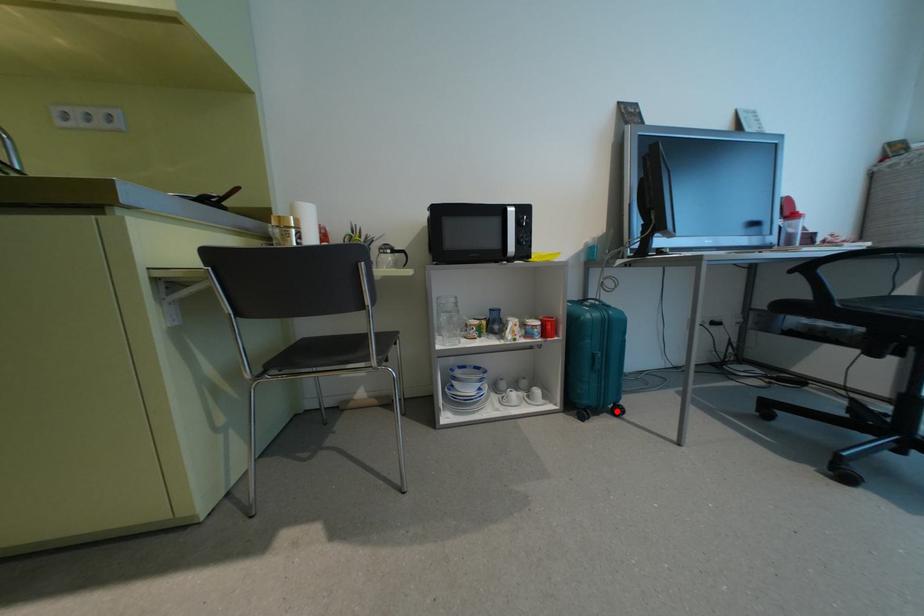
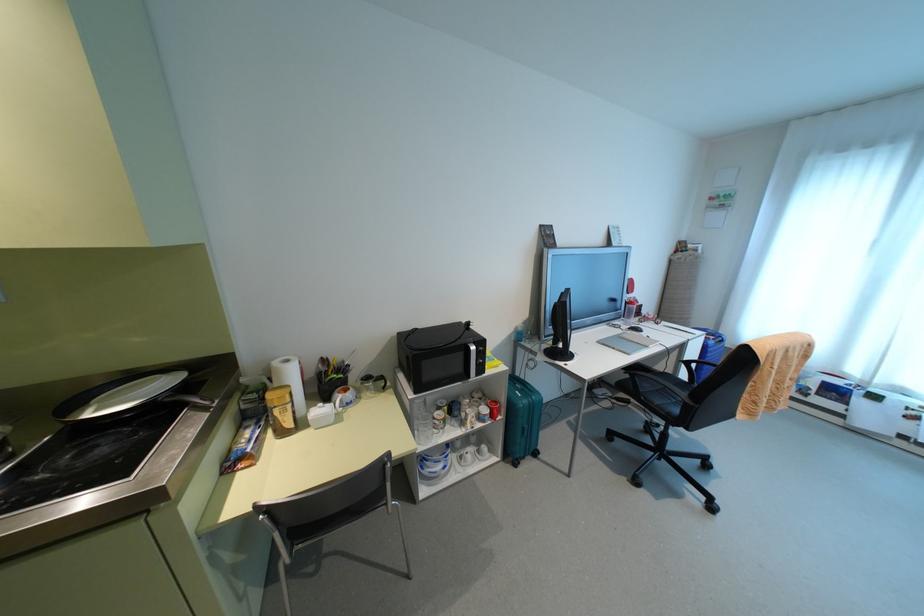
In the second image, find the point that corresponds to the highlighted location in the first image.

(535, 454)